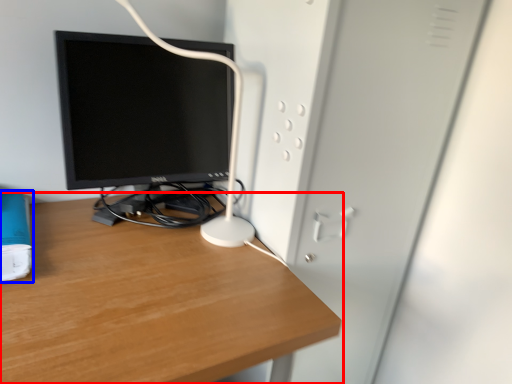
Question: Which object is further to the camera taking this photo, desk (highlighted by a red box) or paperback book (highlighted by a blue box)?

Choices:
 (A) desk
 (B) paperback book

Answer: (B)